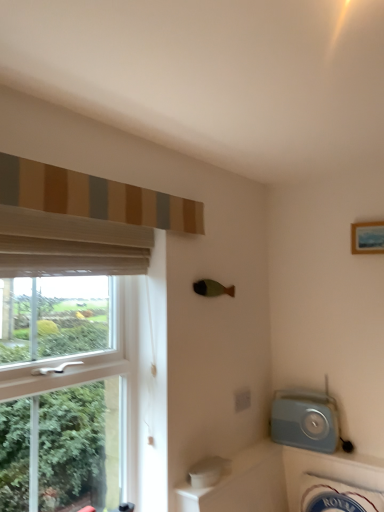
Question: Can you confirm if matte blue radio at lower right is taller than wooden framed picture at upper right?

Choices:
 (A) no
 (B) yes

Answer: (B)

Question: From the image's perspective, would you say matte blue radio at lower right is positioned over wooden framed picture at upper right?

Choices:
 (A) yes
 (B) no

Answer: (B)

Question: Would you say matte blue radio at lower right is outside wooden framed picture at upper right?

Choices:
 (A) no
 (B) yes

Answer: (B)

Question: Is matte blue radio at lower right oriented away from wooden framed picture at upper right?

Choices:
 (A) yes
 (B) no

Answer: (B)

Question: Does matte blue radio at lower right appear on the left side of wooden framed picture at upper right?

Choices:
 (A) no
 (B) yes

Answer: (B)

Question: Is matte blue radio at lower right thinner than wooden framed picture at upper right?

Choices:
 (A) no
 (B) yes

Answer: (A)

Question: Does white ceramic bath at lower right have a lesser height compared to wooden framed picture at upper right?

Choices:
 (A) no
 (B) yes

Answer: (A)

Question: From the image's perspective, does white ceramic bath at lower right appear higher than wooden framed picture at upper right?

Choices:
 (A) yes
 (B) no

Answer: (B)

Question: Does white ceramic bath at lower right touch wooden framed picture at upper right?

Choices:
 (A) yes
 (B) no

Answer: (B)

Question: Considering the relative sizes of white ceramic bath at lower right and wooden framed picture at upper right in the image provided, is white ceramic bath at lower right bigger than wooden framed picture at upper right?

Choices:
 (A) yes
 (B) no

Answer: (A)

Question: Does white ceramic bath at lower right have a greater height compared to wooden framed picture at upper right?

Choices:
 (A) no
 (B) yes

Answer: (B)

Question: Does white ceramic bath at lower right have a greater width compared to wooden framed picture at upper right?

Choices:
 (A) yes
 (B) no

Answer: (A)

Question: Is wooden framed picture at upper right next to white sheer curtain at left, which is the 2th curtain from top to bottom?

Choices:
 (A) no
 (B) yes

Answer: (A)